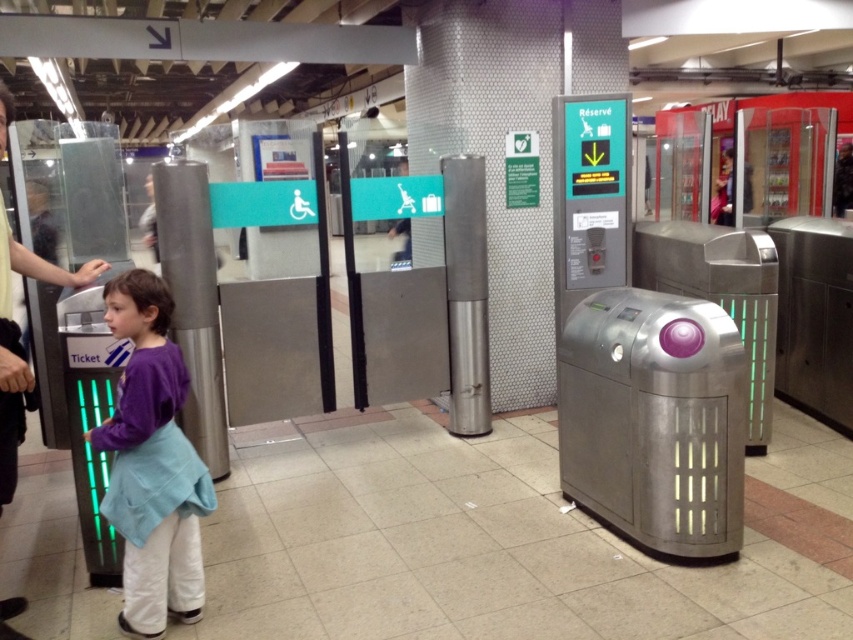
Question: Does purple fabric dress at left have a lesser width compared to silver metallic pillar at center?

Choices:
 (A) no
 (B) yes

Answer: (A)

Question: Can you confirm if purple fabric dress at left is positioned below dark gray shirt at left?

Choices:
 (A) yes
 (B) no

Answer: (A)

Question: Which point is closer to the camera taking this photo?

Choices:
 (A) (187, 225)
 (B) (6, 285)
 (C) (128, 627)

Answer: (B)

Question: Does purple fabric dress at left appear over dark gray shirt at left?

Choices:
 (A) no
 (B) yes

Answer: (A)

Question: Which point is farther to the camera?

Choices:
 (A) (210, 228)
 (B) (16, 605)
 (C) (119, 474)

Answer: (A)

Question: Among these objects, which one is farthest from the camera?

Choices:
 (A) silver metallic pillar at center
 (B) dark gray shirt at left
 (C) purple fabric dress at left

Answer: (A)